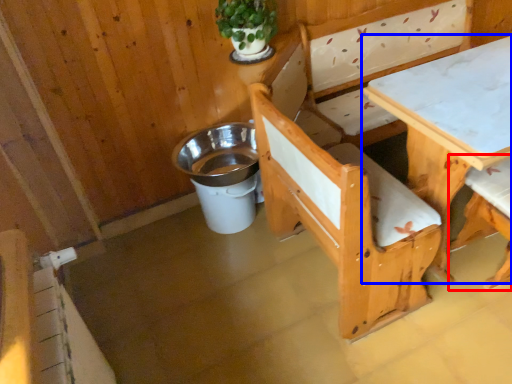
Question: Which object appears farthest to the camera in this image, chair (highlighted by a red box) or table (highlighted by a blue box)?

Choices:
 (A) chair
 (B) table

Answer: (A)